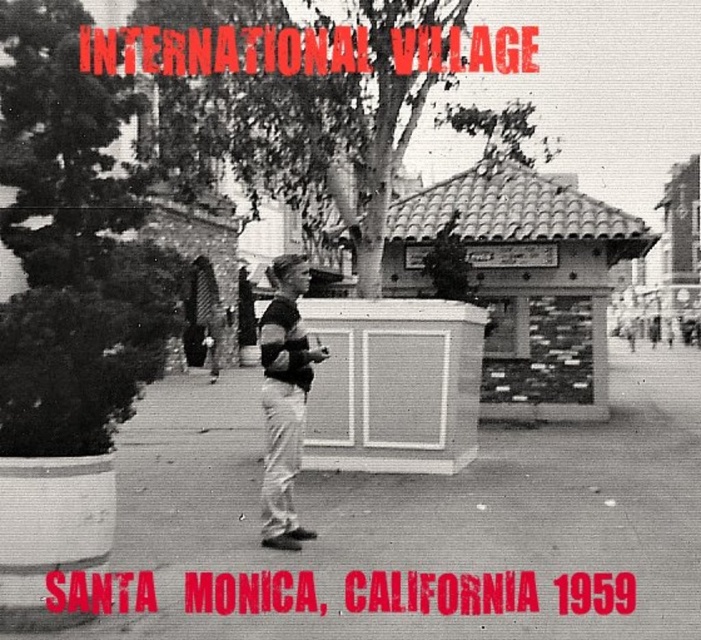
Between smooth concrete pavement at center and matte black shirt at center, which one is positioned higher?

matte black shirt at center is higher up.

Describe the element at coordinates (423, 512) in the screenshot. I see `smooth concrete pavement at center` at that location.

Who is more forward, [510,534] or [272,497]?

Positioned in front is point [272,497].

At what (x,y) coordinates should I click in order to perform the action: click on smooth concrete pavement at center. Please return your answer as a coordinate pair (x, y). The width and height of the screenshot is (701, 640). Looking at the image, I should click on (423, 512).